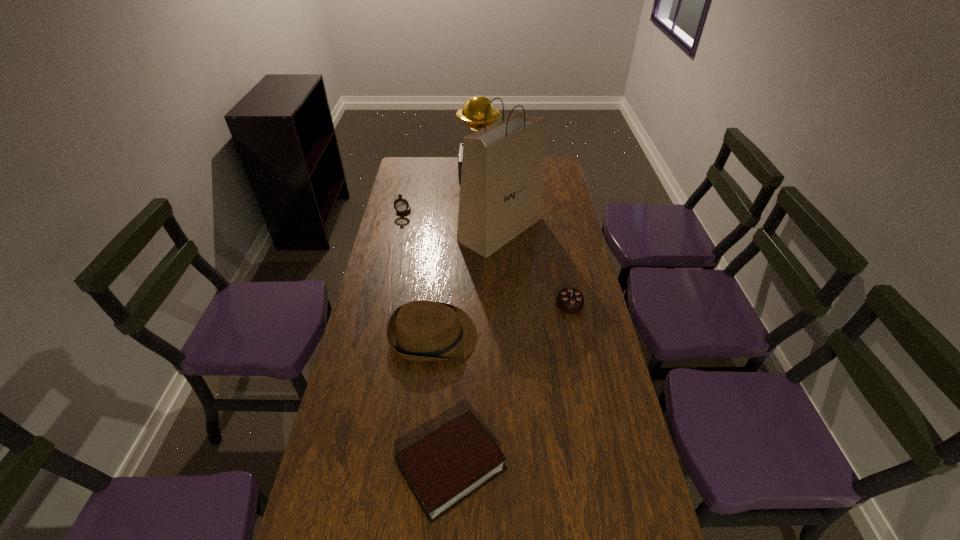
Identify the location of vacant space positioned on the face of the compass. This screenshot has height=540, width=960. (396, 241).

Where is `vacant space located on the front of the chocolate cake`? The width and height of the screenshot is (960, 540). vacant space located on the front of the chocolate cake is located at coordinates 580,356.

You are a GUI agent. You are given a task and a screenshot of the screen. Output one action in this format:
    pyautogui.click(x=<x>, y=<y>)
    Task: Click on the vacant space positioned 0.270m on the back of the Bible
    The height and width of the screenshot is (540, 960).
    Given the screenshot: What is the action you would take?
    pyautogui.click(x=458, y=340)

Find the location of a particular element. The width and height of the screenshot is (960, 540). object that is at the far edge is located at coordinates (473, 112).

This screenshot has width=960, height=540. Find the location of `fedora present at the left edge`. fedora present at the left edge is located at coordinates (421, 330).

This screenshot has width=960, height=540. What are the coordinates of `compass at the left edge` in the screenshot? It's located at point(401,205).

What are the coordinates of `shopping bag present at the right edge` in the screenshot? It's located at (501, 179).

At what (x,y) coordinates should I click in order to perform the action: click on chocolate cake located at the right edge. Please return your answer as a coordinate pair (x, y). This screenshot has height=540, width=960. Looking at the image, I should click on (569, 300).

Where is `vacant region at the left edge`? The height and width of the screenshot is (540, 960). vacant region at the left edge is located at coordinates (319, 523).

Locate an element on the screen. vacant space at the right edge of the desktop is located at coordinates (578, 288).